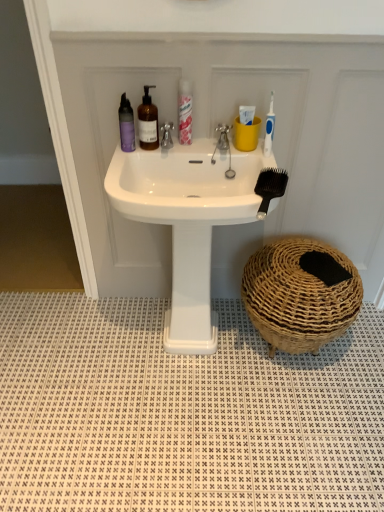
Question: Can you confirm if purple matte bottle at upper left, which is the first mouthwash in left-to-right order, is bigger than white textured tile at lower center?

Choices:
 (A) yes
 (B) no

Answer: (B)

Question: From a real-world perspective, is purple matte bottle at upper left, the 2th mouthwash viewed from the right, on top of white textured tile at lower center?

Choices:
 (A) no
 (B) yes

Answer: (B)

Question: Can we say purple matte bottle at upper left, the 2th mouthwash viewed from the right, lies outside white textured tile at lower center?

Choices:
 (A) yes
 (B) no

Answer: (A)

Question: From a real-world perspective, does purple matte bottle at upper left, which is the first mouthwash in left-to-right order, sit lower than white textured tile at lower center?

Choices:
 (A) yes
 (B) no

Answer: (B)

Question: Can you confirm if purple matte bottle at upper left, the 2th mouthwash viewed from the right, is wider than white textured tile at lower center?

Choices:
 (A) yes
 (B) no

Answer: (B)

Question: Can you confirm if purple matte bottle at upper left, the 2th mouthwash viewed from the right, is taller than white textured tile at lower center?

Choices:
 (A) no
 (B) yes

Answer: (B)

Question: Is purple matte bottle at upper left, the 2th mouthwash viewed from the right, completely or partially inside metallic silver faucet at center, placed as the 2th tap when sorted from right to left?

Choices:
 (A) no
 (B) yes

Answer: (A)

Question: Is purple matte bottle at upper left, the 2th mouthwash viewed from the right, at the back of metallic silver faucet at center, placed as the 2th tap when sorted from right to left?

Choices:
 (A) yes
 (B) no

Answer: (B)

Question: Is metallic silver faucet at center, placed as the 2th tap when sorted from right to left, at the left side of purple matte bottle at upper left, the 2th mouthwash viewed from the right?

Choices:
 (A) yes
 (B) no

Answer: (B)

Question: Does metallic silver faucet at center, placed as the 2th tap when sorted from right to left, have a lesser width compared to purple matte bottle at upper left, the 2th mouthwash viewed from the right?

Choices:
 (A) yes
 (B) no

Answer: (B)

Question: From the image's perspective, is metallic silver faucet at center, placed as the 2th tap when sorted from right to left, on purple matte bottle at upper left, which is the first mouthwash in left-to-right order?

Choices:
 (A) yes
 (B) no

Answer: (B)

Question: From the image's perspective, is metallic silver faucet at center, placed as the 2th tap when sorted from right to left, under purple matte bottle at upper left, the 2th mouthwash viewed from the right?

Choices:
 (A) yes
 (B) no

Answer: (A)

Question: Considering the relative sizes of white textured tile at lower center and translucent pink spray can at upper center in the image provided, is white textured tile at lower center shorter than translucent pink spray can at upper center?

Choices:
 (A) yes
 (B) no

Answer: (A)